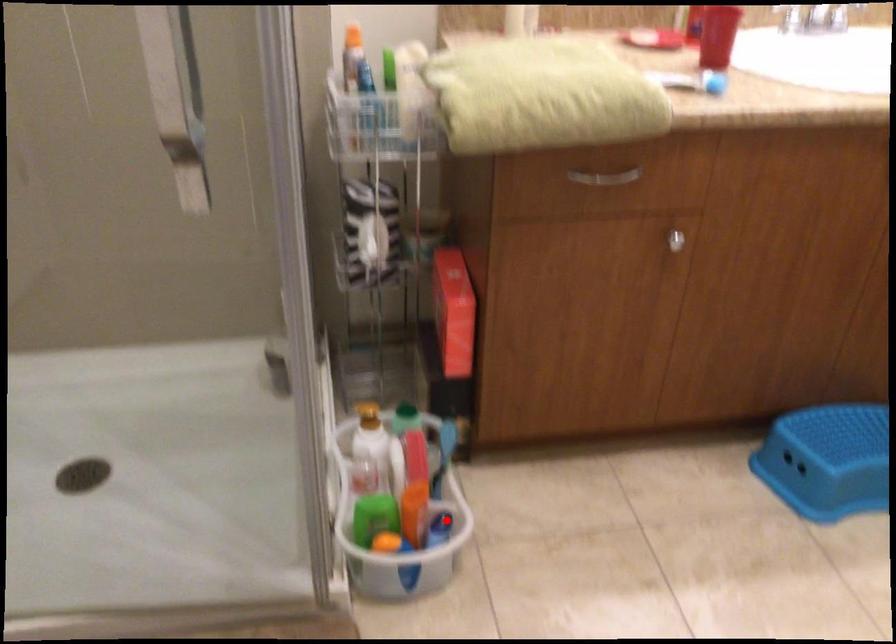
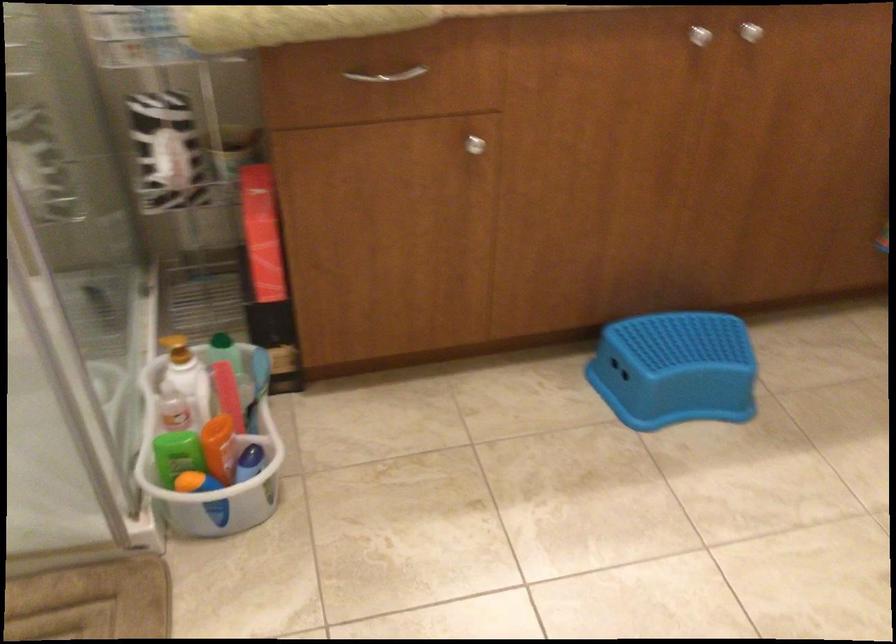
Find the pixel in the second image that matches the highlighted location in the first image.

(255, 451)